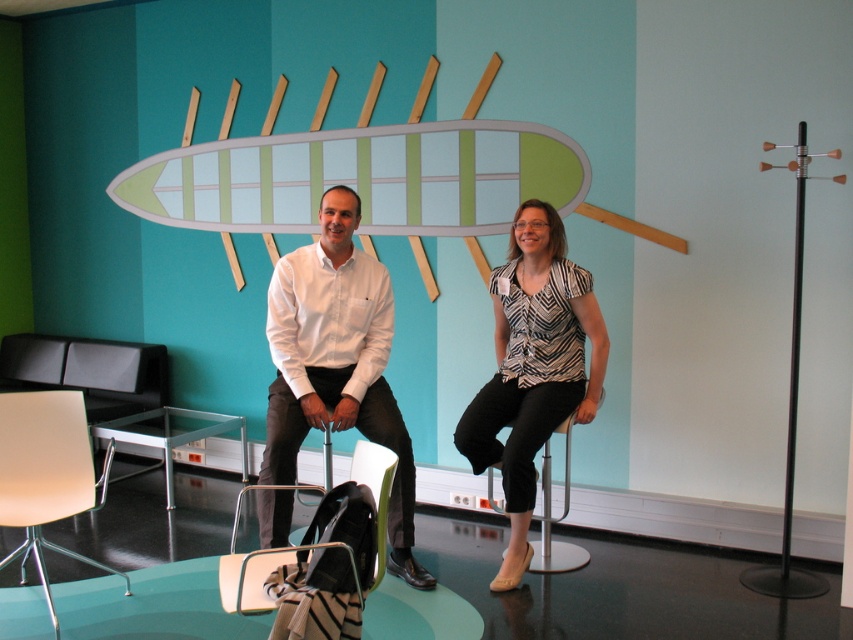
You are standing in the waiting area and need to sit down. You see the matte white chair at lower left and the metallic silver stool at center. Which one is positioned more to the left side of the room?

The matte white chair at lower left is positioned more to the left side of the room than the metallic silver stool at center.

You are a photographer setting up a shoot in this lounge. You have a light meter that measures the reflectivity of surfaces. Which object should you adjust your lighting for more effectively, the white glossy shirt at center or the matte white chair at lower left, and why?

The white glossy shirt at center should be adjusted more carefully because it is above the matte white chair at lower left and likely reflects light more intensely, creating glare or hotspots in the photo.